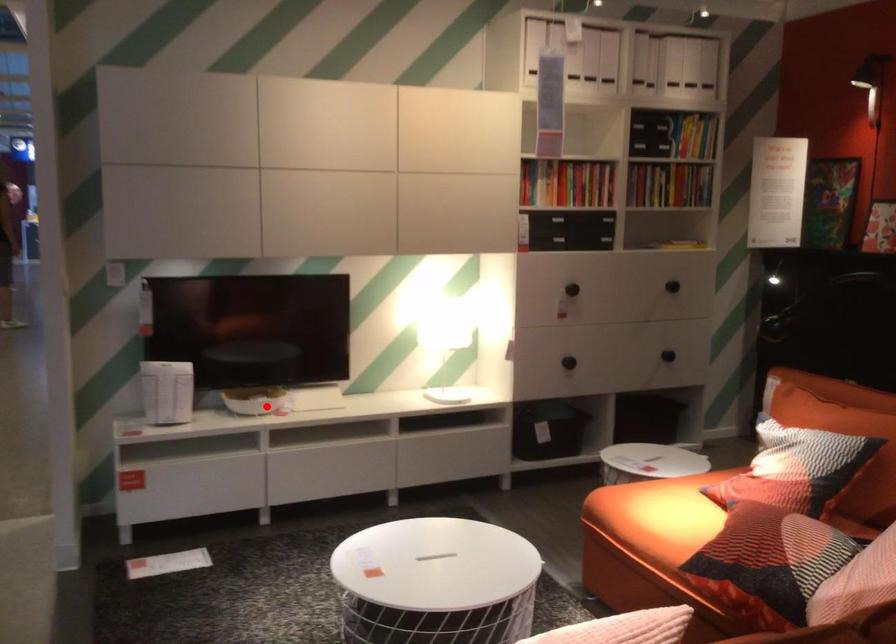
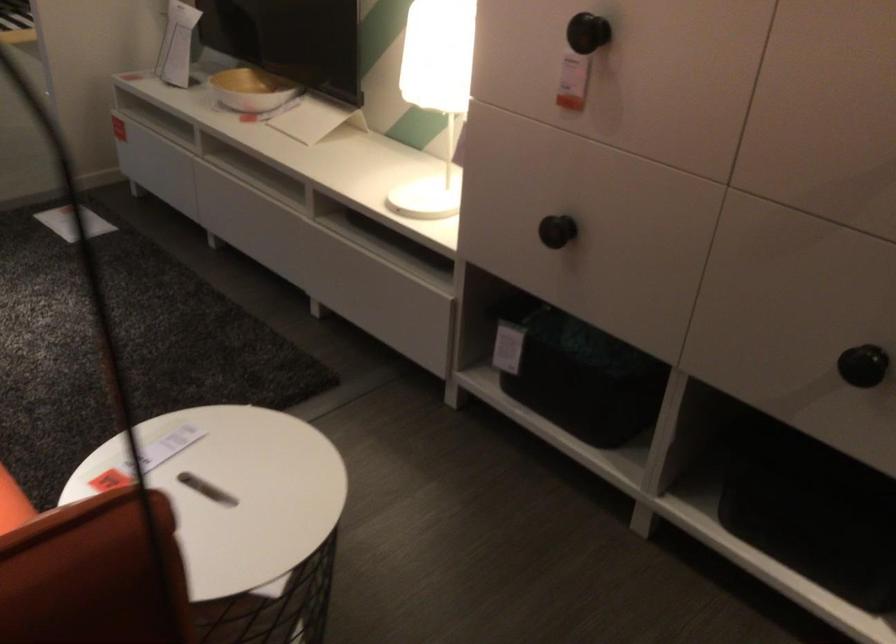
The point at the highlighted location is marked in the first image. Where is the corresponding point in the second image?

(251, 90)